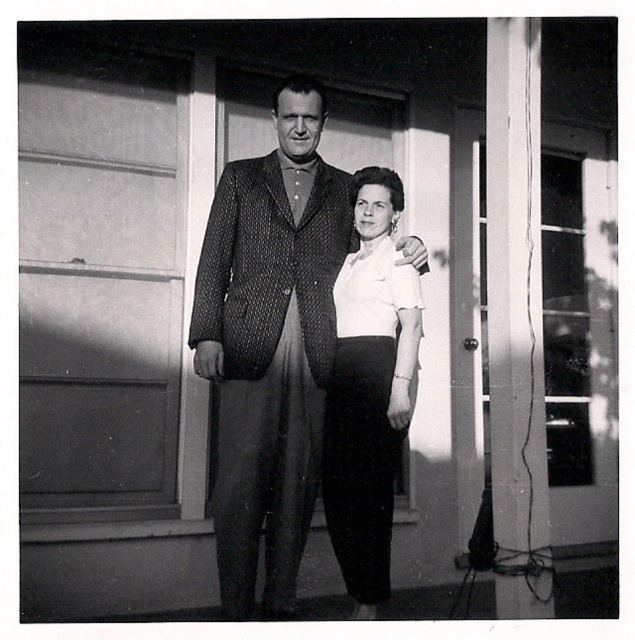
Question: Which point is farther to the camera?

Choices:
 (A) white cotton blouse at center
 (B) smooth wood pillar at right

Answer: (A)

Question: Among these points, which one is farthest from the camera?

Choices:
 (A) (244, 163)
 (B) (535, 584)

Answer: (A)

Question: Is polka dot suit at center further to the viewer compared to smooth wood pillar at right?

Choices:
 (A) no
 (B) yes

Answer: (B)

Question: Can you confirm if polka dot suit at center is positioned above smooth wood pillar at right?

Choices:
 (A) no
 (B) yes

Answer: (A)

Question: Is polka dot suit at center to the left of white cotton blouse at center from the viewer's perspective?

Choices:
 (A) no
 (B) yes

Answer: (B)

Question: Which object is closer to the camera taking this photo?

Choices:
 (A) smooth wood pillar at right
 (B) white cotton blouse at center
 (C) polka dot suit at center

Answer: (A)